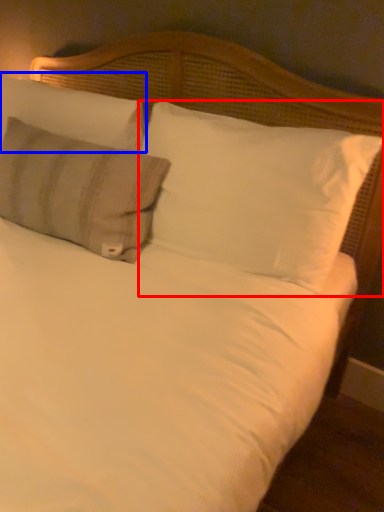
Question: Which of the following is the closest to the observer, pillow (highlighted by a red box) or pillow (highlighted by a blue box)?

Choices:
 (A) pillow
 (B) pillow

Answer: (A)